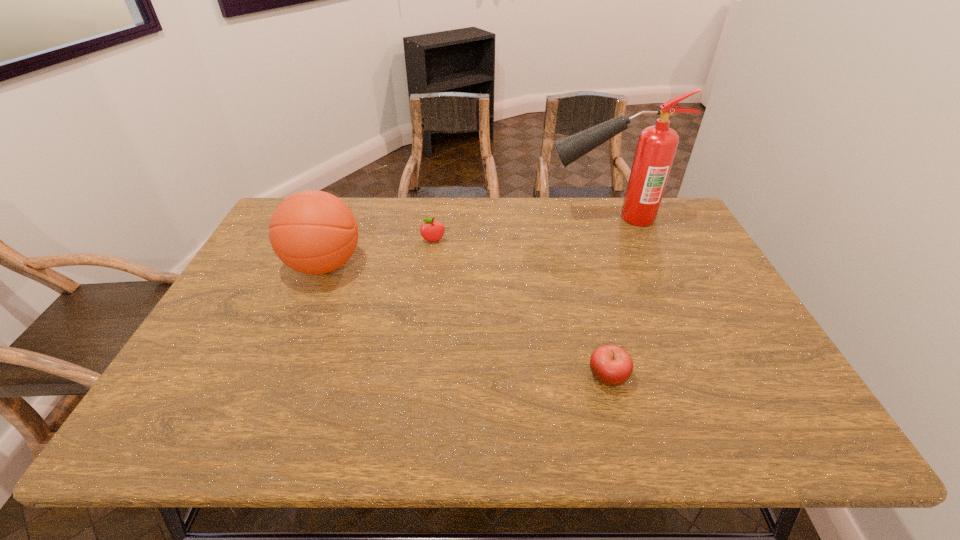
Find the location of a particular element. Image resolution: width=960 pixels, height=540 pixels. the tallest object is located at coordinates coord(657,145).

Image resolution: width=960 pixels, height=540 pixels. What are the coordinates of `the farthest object` in the screenshot? It's located at (657, 145).

This screenshot has width=960, height=540. Find the location of `the leftmost object`. the leftmost object is located at coordinates (314, 232).

Find the location of `the second tallest object`. the second tallest object is located at coordinates (314, 232).

Locate an element on the screen. This screenshot has height=540, width=960. the farther apple is located at coordinates tap(431, 231).

The height and width of the screenshot is (540, 960). I want to click on the second object from left to right, so click(431, 231).

In order to click on the nearer apple in this screenshot , I will do `click(611, 365)`.

This screenshot has height=540, width=960. Find the location of `the right apple`. the right apple is located at coordinates (611, 365).

Identify the location of vacant space located at the nozzle of the fire extinguisher. This screenshot has height=540, width=960. (465, 218).

Locate an element on the screen. The image size is (960, 540). vacant area situated 0.380m at the nozzle of the fire extinguisher is located at coordinates (432, 218).